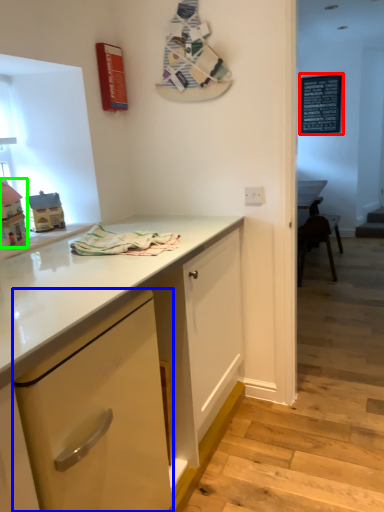
Question: Which object is positioned closest to bulletin board (highlighted by a red box)? Select from cabinetry (highlighted by a blue box) and toy (highlighted by a green box).

Choices:
 (A) cabinetry
 (B) toy

Answer: (B)